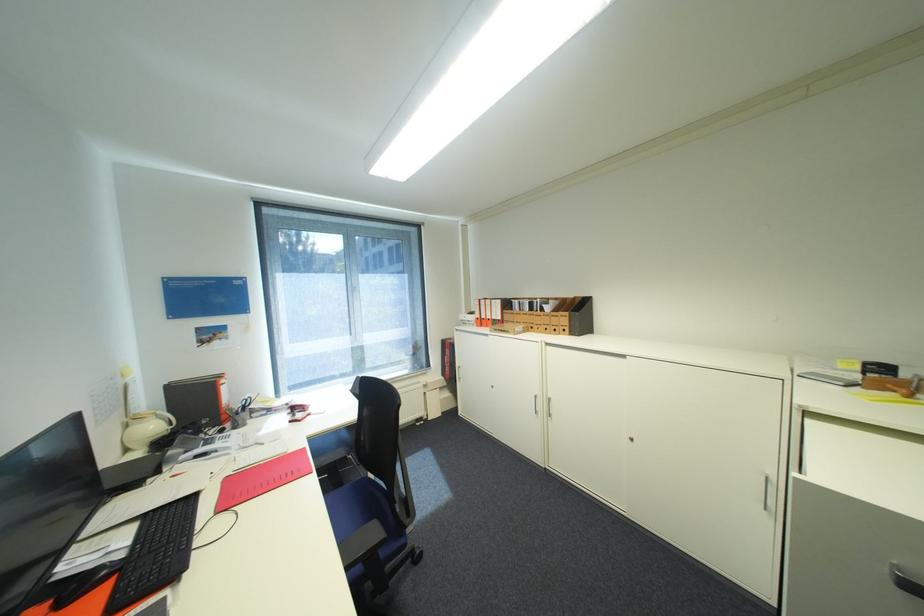
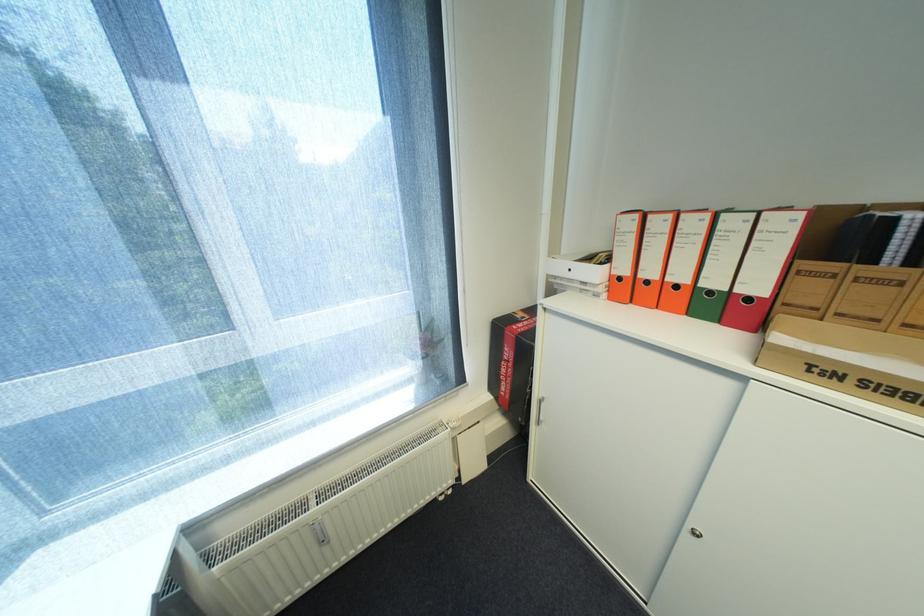
Find the pixel in the second image that matches the point at 513,315 in the first image.

(806, 282)